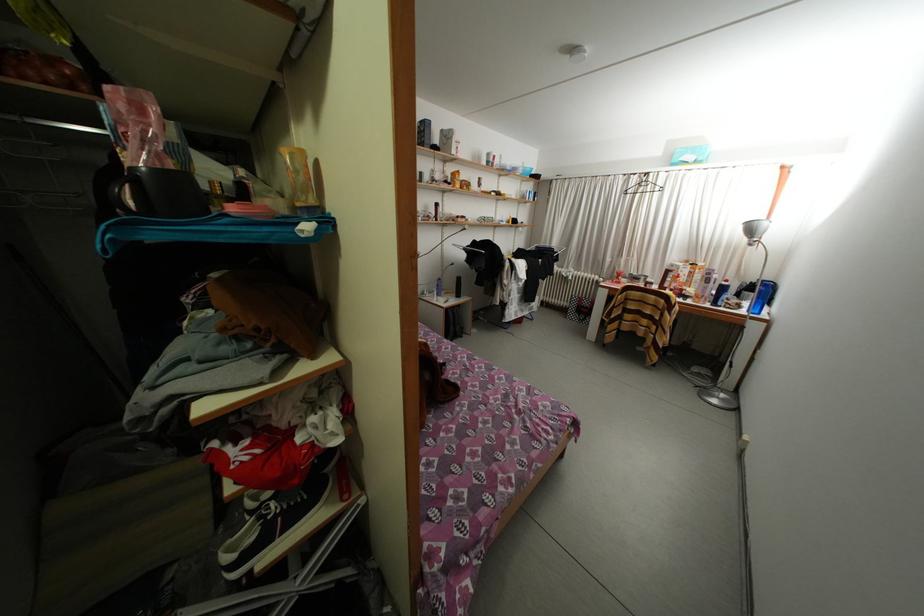
Find the location of a particular element. This screenshot has height=616, width=924. black mug handle is located at coordinates (118, 193).